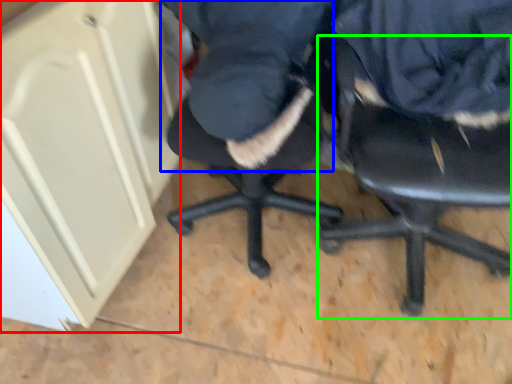
Question: Which is farther away from cabinetry (highlighted by a red box)? clothing (highlighted by a blue box) or chair (highlighted by a green box)?

Choices:
 (A) clothing
 (B) chair

Answer: (B)